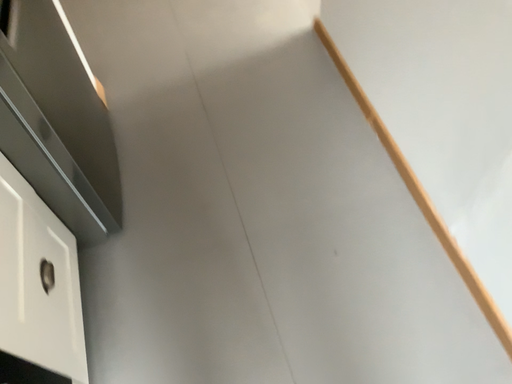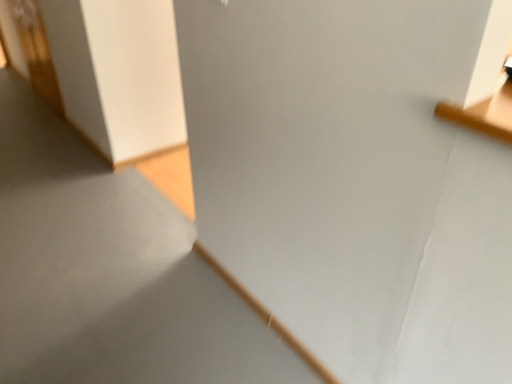
Question: Which way did the camera rotate in the video?

Choices:
 (A) rotated upward
 (B) rotated downward

Answer: (A)